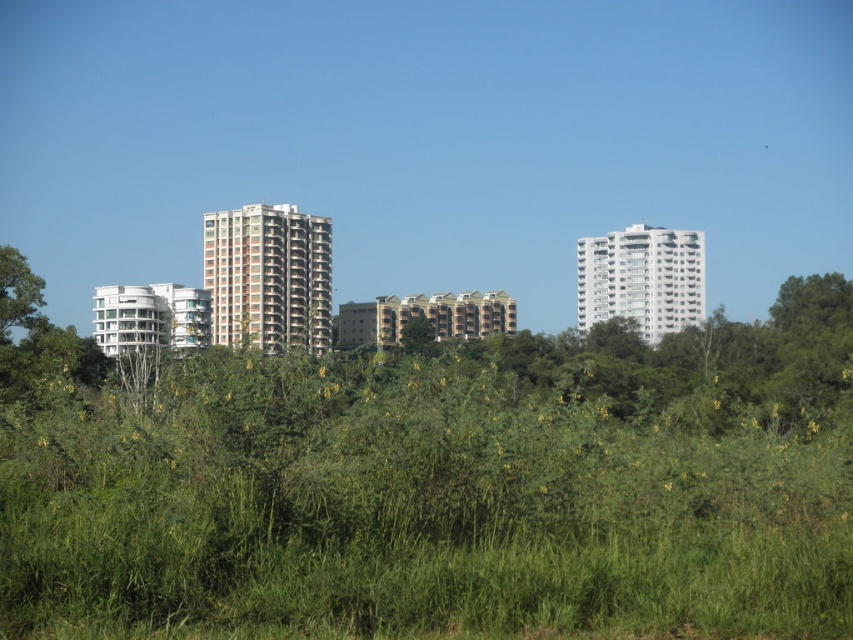
Question: Does white glossy building at upper right have a smaller size compared to green leafy tree at center?

Choices:
 (A) no
 (B) yes

Answer: (A)

Question: Which point is farther to the camera?

Choices:
 (A) (212, 272)
 (B) (19, 292)

Answer: (A)

Question: Is orange brick building at center to the right of green leafy tree at center from the viewer's perspective?

Choices:
 (A) yes
 (B) no

Answer: (B)

Question: Which point is farther to the camera?

Choices:
 (A) orange brick building at center
 (B) white glossy building at upper right
 (C) green leafy tree at center

Answer: (B)

Question: Does white glossy building at upper right have a smaller size compared to green leafy tree at center?

Choices:
 (A) no
 (B) yes

Answer: (A)

Question: Among these objects, which one is nearest to the camera?

Choices:
 (A) orange brick building at center
 (B) green leafy tree at center
 (C) green leafy tree at left

Answer: (A)